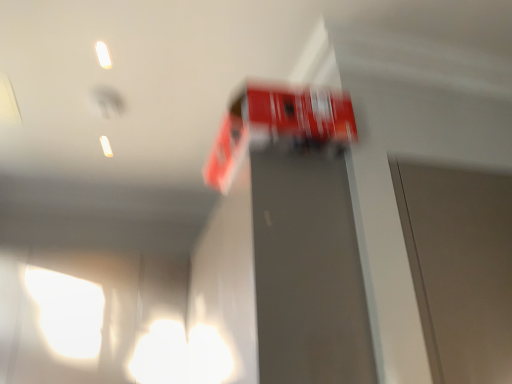
Question: Can you confirm if red glossy fire truck at upper center is wider than metallic gray elevator door at center?

Choices:
 (A) yes
 (B) no

Answer: (A)

Question: From a real-world perspective, is red glossy fire truck at upper center beneath metallic gray elevator door at center?

Choices:
 (A) no
 (B) yes

Answer: (A)

Question: From the image's perspective, would you say red glossy fire truck at upper center is shown under metallic gray elevator door at center?

Choices:
 (A) yes
 (B) no

Answer: (B)

Question: Is red glossy fire truck at upper center smaller than metallic gray elevator door at center?

Choices:
 (A) yes
 (B) no

Answer: (A)

Question: Can you confirm if red glossy fire truck at upper center is taller than metallic gray elevator door at center?

Choices:
 (A) no
 (B) yes

Answer: (A)

Question: Is red glossy fire truck at upper center not within metallic gray elevator door at center?

Choices:
 (A) no
 (B) yes

Answer: (B)

Question: Can you confirm if metallic gray elevator door at center is smaller than red glossy fire truck at upper center?

Choices:
 (A) no
 (B) yes

Answer: (A)

Question: From a real-world perspective, is metallic gray elevator door at center located higher than red glossy fire truck at upper center?

Choices:
 (A) yes
 (B) no

Answer: (B)

Question: Considering the relative sizes of metallic gray elevator door at center and red glossy fire truck at upper center in the image provided, is metallic gray elevator door at center shorter than red glossy fire truck at upper center?

Choices:
 (A) no
 (B) yes

Answer: (A)

Question: From a real-world perspective, is metallic gray elevator door at center beneath red glossy fire truck at upper center?

Choices:
 (A) yes
 (B) no

Answer: (A)

Question: Does metallic gray elevator door at center turn towards red glossy fire truck at upper center?

Choices:
 (A) yes
 (B) no

Answer: (B)

Question: Can you confirm if metallic gray elevator door at center is wider than red glossy fire truck at upper center?

Choices:
 (A) yes
 (B) no

Answer: (B)

Question: Considering their positions, is red glossy fire truck at upper center located in front of or behind metallic gray elevator door at center?

Choices:
 (A) front
 (B) behind

Answer: (B)